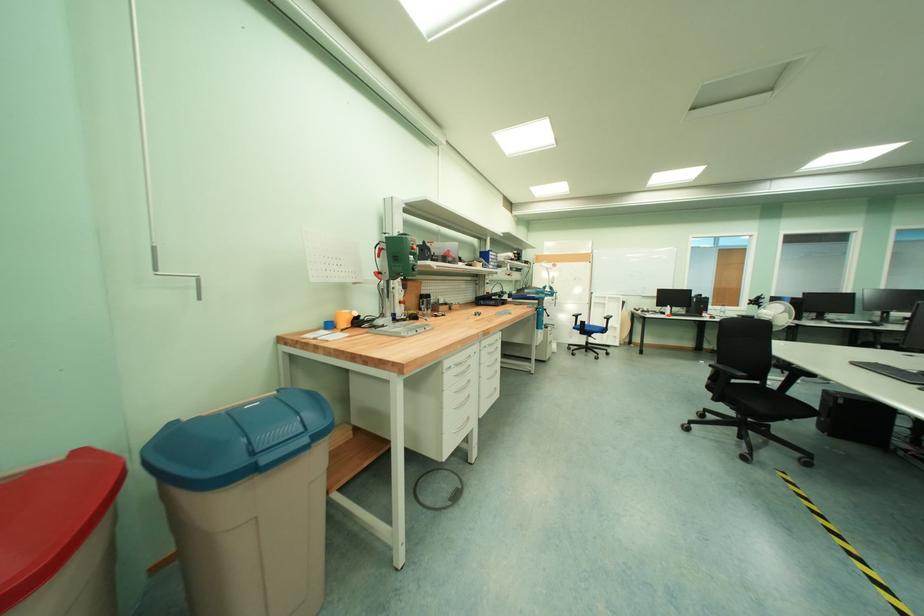
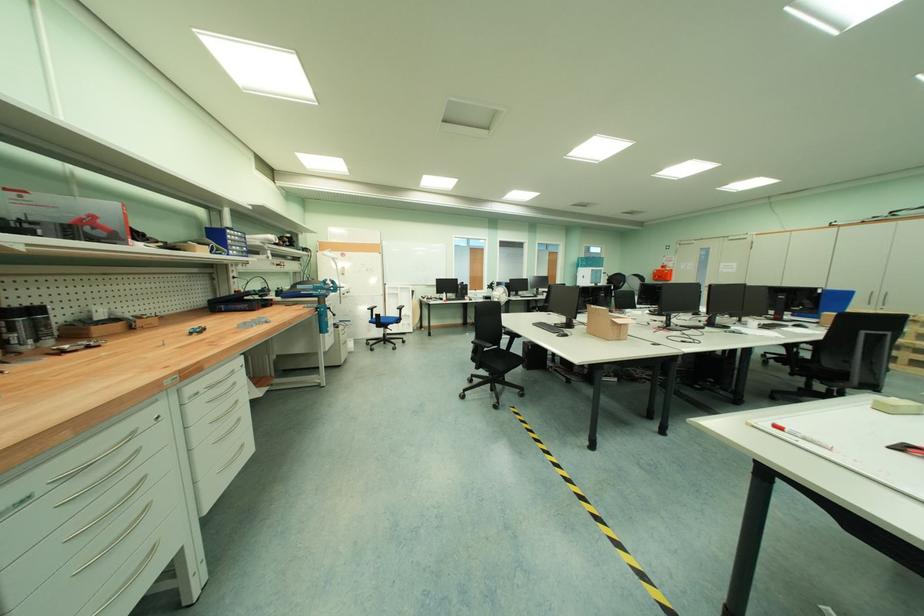
Question: The first image is from the beginning of the video and the second image is from the end. How did the camera likely rotate when shooting the video?

Choices:
 (A) Left
 (B) Right
 (C) Up
 (D) Down

Answer: (B)